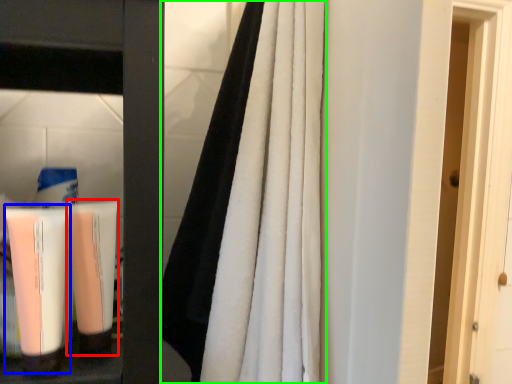
Question: Which object is the closest to the shaving cream (highlighted by a red box)? Choose among these: cleaning product (highlighted by a blue box) or curtain (highlighted by a green box).

Choices:
 (A) cleaning product
 (B) curtain

Answer: (A)